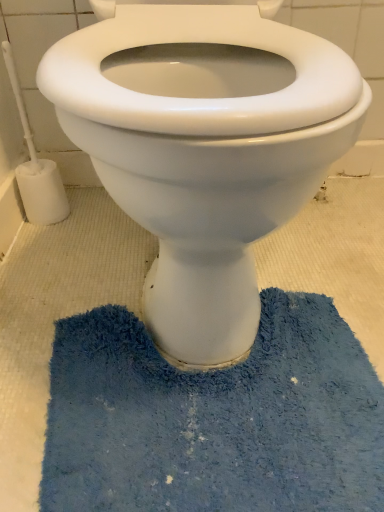
Question: Considering the relative sizes of blue shaggy bath mat at lower center and white glossy toilet at center in the image provided, is blue shaggy bath mat at lower center taller than white glossy toilet at center?

Choices:
 (A) no
 (B) yes

Answer: (A)

Question: Is blue shaggy bath mat at lower center positioned far away from white glossy toilet at center?

Choices:
 (A) no
 (B) yes

Answer: (A)

Question: From a real-world perspective, is blue shaggy bath mat at lower center positioned under white glossy toilet at center based on gravity?

Choices:
 (A) no
 (B) yes

Answer: (B)

Question: Does blue shaggy bath mat at lower center have a smaller size compared to white glossy toilet at center?

Choices:
 (A) yes
 (B) no

Answer: (A)

Question: Does blue shaggy bath mat at lower center have a larger size compared to white glossy toilet at center?

Choices:
 (A) yes
 (B) no

Answer: (B)

Question: Does point (76, 425) appear closer or farther from the camera than point (278, 23)?

Choices:
 (A) closer
 (B) farther

Answer: (A)

Question: Choose the correct answer: Is blue shaggy bath mat at lower center inside white glossy toilet at center or outside it?

Choices:
 (A) outside
 (B) inside

Answer: (A)

Question: From the image's perspective, relative to white glossy toilet at center, is blue shaggy bath mat at lower center above or below?

Choices:
 (A) above
 (B) below

Answer: (B)

Question: Is blue shaggy bath mat at lower center to the left or to the right of white glossy toilet at center in the image?

Choices:
 (A) left
 (B) right

Answer: (B)

Question: In terms of size, does white glossy toilet at center appear bigger or smaller than white plastic toilet brush at left?

Choices:
 (A) small
 (B) big

Answer: (B)

Question: Considering their positions, is white glossy toilet at center located in front of or behind white plastic toilet brush at left?

Choices:
 (A) behind
 (B) front

Answer: (B)

Question: Visually, is white glossy toilet at center positioned to the left or to the right of white plastic toilet brush at left?

Choices:
 (A) left
 (B) right

Answer: (B)

Question: Considering the positions of white glossy toilet at center and white plastic toilet brush at left in the image, is white glossy toilet at center wider or thinner than white plastic toilet brush at left?

Choices:
 (A) thin
 (B) wide

Answer: (B)

Question: Looking at the image, does blue shaggy bath mat at lower center seem bigger or smaller compared to white plastic toilet brush at left?

Choices:
 (A) big
 (B) small

Answer: (A)

Question: Is blue shaggy bath mat at lower center inside or outside of white plastic toilet brush at left?

Choices:
 (A) outside
 (B) inside

Answer: (A)